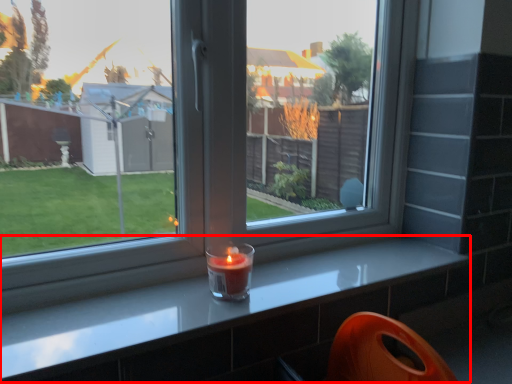
Question: From the image's perspective, what is the correct spatial positioning of counter (annotated by the red box) in reference to candle holder?

Choices:
 (A) below
 (B) above

Answer: (A)